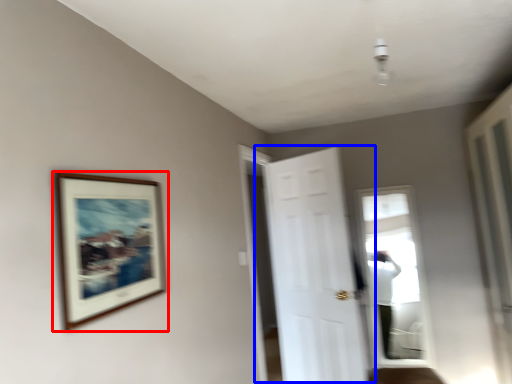
Question: Which object is closer to the camera taking this photo, picture frame (highlighted by a red box) or door (highlighted by a blue box)?

Choices:
 (A) picture frame
 (B) door

Answer: (A)